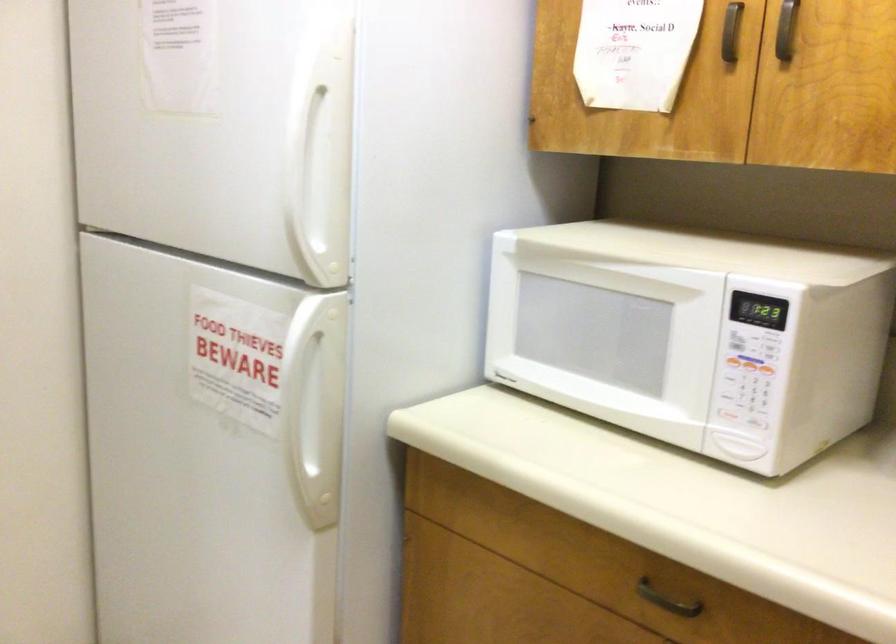
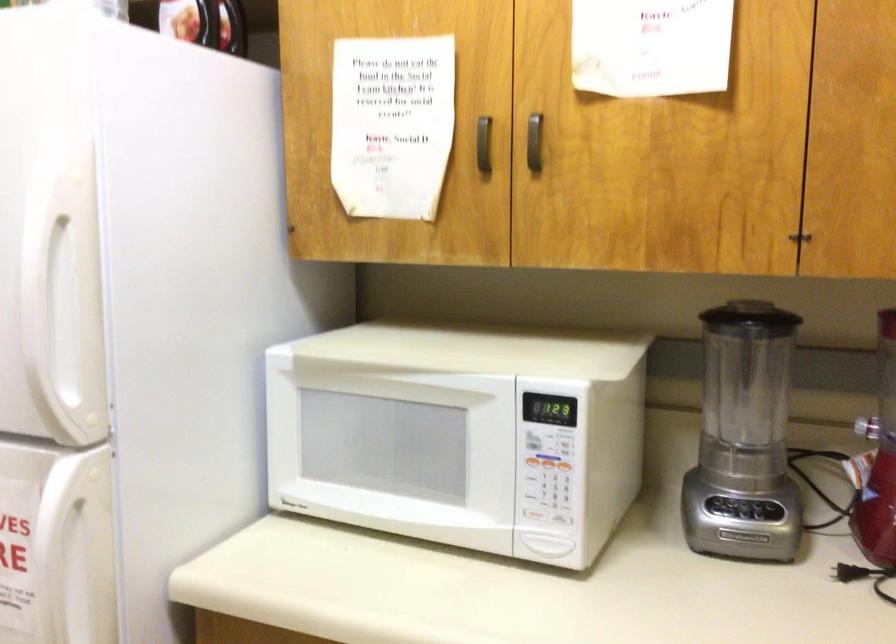
The point at (748, 359) is marked in the first image. Where is the corresponding point in the second image?

(547, 462)